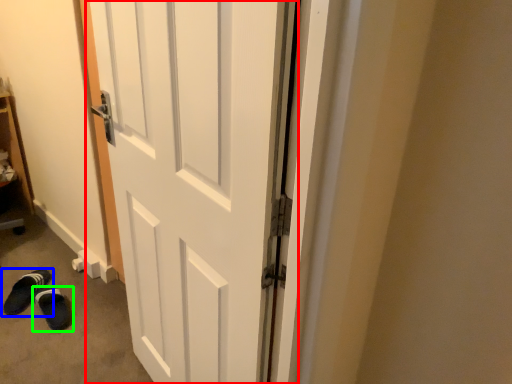
Question: Considering the real-world distances, which object is closest to door (highlighted by a red box)? footwear (highlighted by a blue box) or footwear (highlighted by a green box).

Choices:
 (A) footwear
 (B) footwear

Answer: (B)